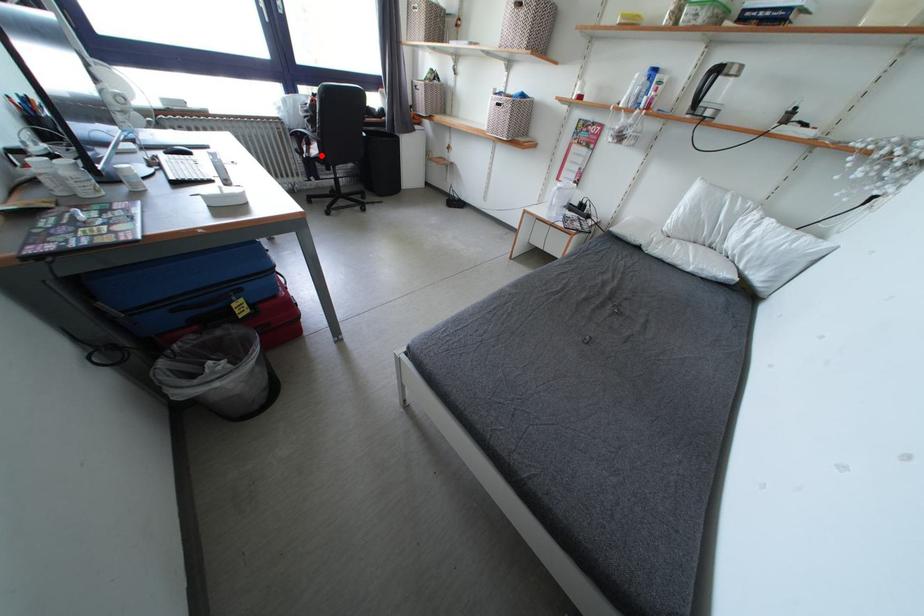
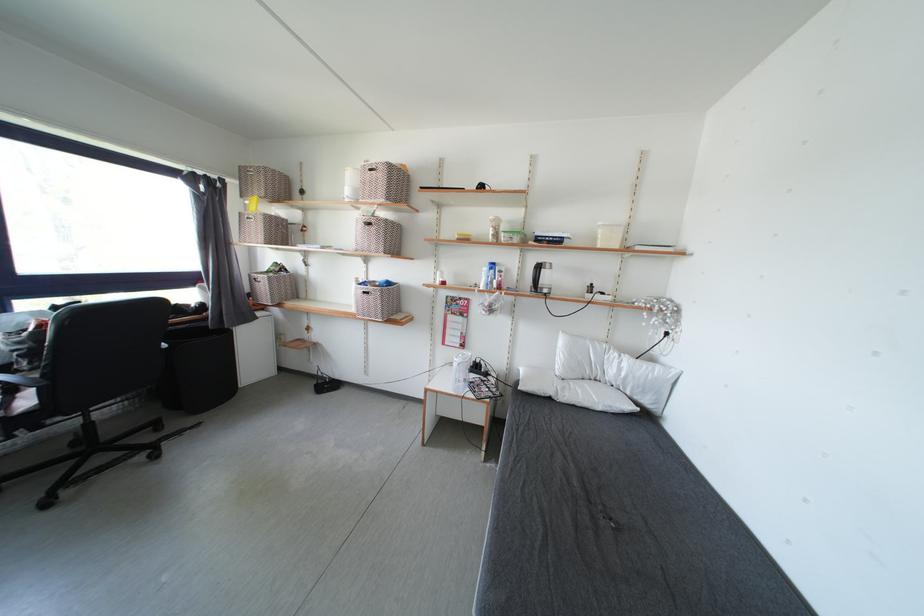
Question: I am providing you with two images of the same scene from different viewpoints. Given a red point in image1, look at the same physical point in image2. Is it:

Choices:
 (A) Closer to the viewpoint
 (B) Farther from the viewpoint

Answer: (B)